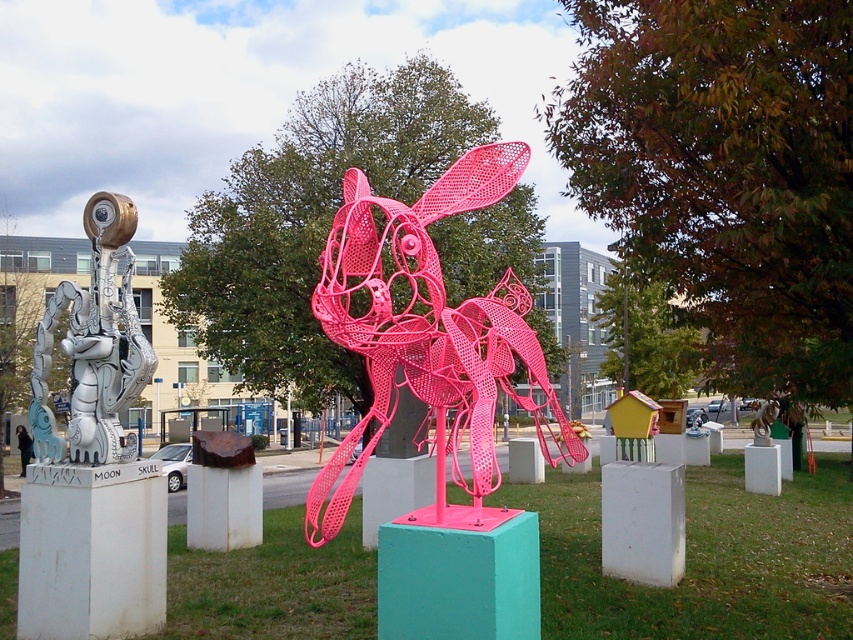
Question: Based on their relative distances, which object is farther from the brushed metal sphere at left?

Choices:
 (A) pink wireframe rabbit at center
 (B) pink wireframe dog at center

Answer: (A)

Question: Is the position of pink wireframe dog at center more distant than that of brushed metal sphere at left?

Choices:
 (A) no
 (B) yes

Answer: (A)

Question: Which is farther from the brushed metal sphere at left?

Choices:
 (A) pink wireframe rabbit at center
 (B) pink wireframe dog at center

Answer: (A)

Question: Which of these objects is positioned farthest from the brushed metal sphere at left?

Choices:
 (A) pink wireframe dog at center
 (B) pink wireframe rabbit at center

Answer: (B)

Question: Is pink wireframe rabbit at center wider than brushed metal sphere at left?

Choices:
 (A) no
 (B) yes

Answer: (B)

Question: Is pink wireframe rabbit at center bigger than brushed metal sphere at left?

Choices:
 (A) yes
 (B) no

Answer: (A)